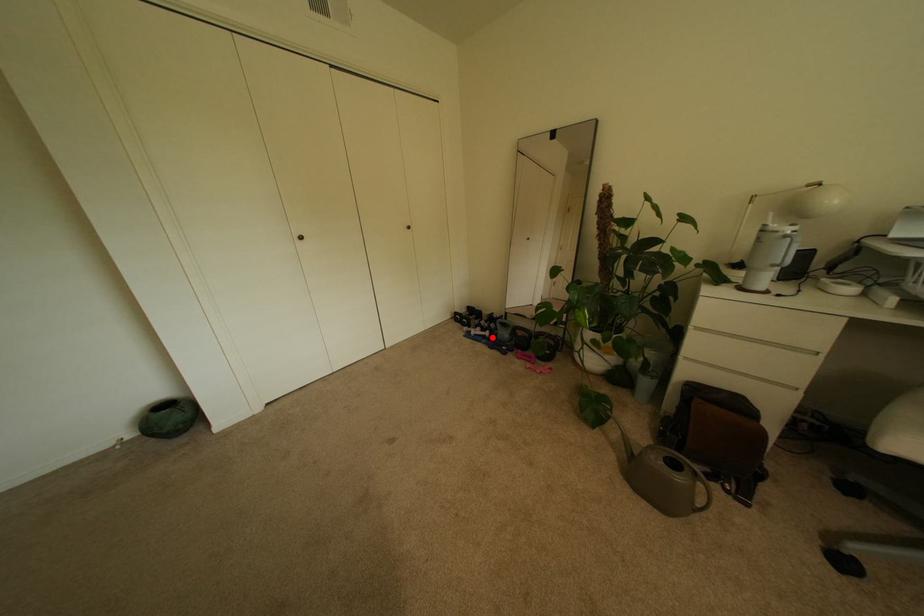
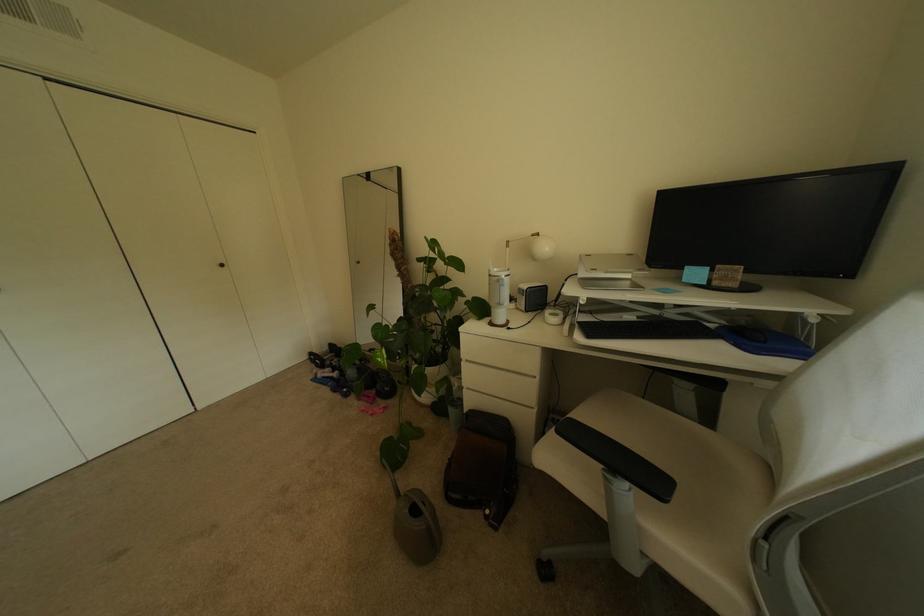
Question: I am providing you with two images of the same scene from different viewpoints. Image1 has a red point marked. In image2, the corresponding 3D location appears at what relative position? Reply with the corresponding letter.

Choices:
 (A) Closer
 (B) Farther

Answer: (A)